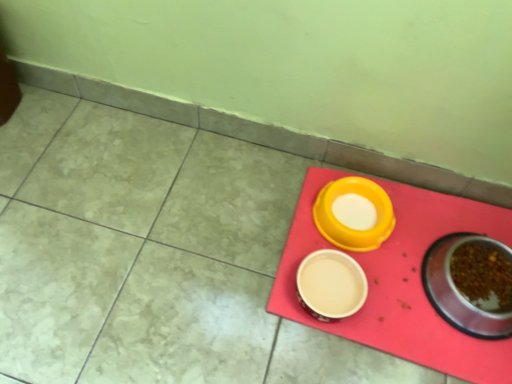
Question: Is beige ceramic bowl at center, placed as the 3th tableware when sorted from right to left, facing towards metallic stainless steel bowl at lower right, which is counted as the first tableware, starting from the right?

Choices:
 (A) no
 (B) yes

Answer: (A)

Question: Considering the relative sizes of beige ceramic bowl at center, the first tableware in the left-to-right sequence, and metallic stainless steel bowl at lower right, which is counted as the first tableware, starting from the right, in the image provided, is beige ceramic bowl at center, the first tableware in the left-to-right sequence, taller than metallic stainless steel bowl at lower right, which is counted as the first tableware, starting from the right,?

Choices:
 (A) yes
 (B) no

Answer: (B)

Question: Considering the relative sizes of beige ceramic bowl at center, the first tableware in the left-to-right sequence, and metallic stainless steel bowl at lower right, the third tableware positioned from the left, in the image provided, is beige ceramic bowl at center, the first tableware in the left-to-right sequence, shorter than metallic stainless steel bowl at lower right, the third tableware positioned from the left,?

Choices:
 (A) no
 (B) yes

Answer: (B)

Question: Considering the relative positions of beige ceramic bowl at center, placed as the 3th tableware when sorted from right to left, and metallic stainless steel bowl at lower right, which is counted as the first tableware, starting from the right, in the image provided, is beige ceramic bowl at center, placed as the 3th tableware when sorted from right to left, to the right of metallic stainless steel bowl at lower right, which is counted as the first tableware, starting from the right, from the viewer's perspective?

Choices:
 (A) no
 (B) yes

Answer: (A)

Question: Is beige ceramic bowl at center, the first tableware in the left-to-right sequence, facing away from metallic stainless steel bowl at lower right, the third tableware positioned from the left?

Choices:
 (A) no
 (B) yes

Answer: (A)

Question: In the image, is rubberized red tray at lower right positioned in front of or behind yellow plastic bowl at center, which ranks as the 2th tableware in right-to-left order?

Choices:
 (A) front
 (B) behind

Answer: (A)

Question: From a real-world perspective, is rubberized red tray at lower right physically located above or below yellow plastic bowl at center, which appears as the 2th tableware when viewed from the left?

Choices:
 (A) below
 (B) above

Answer: (A)

Question: Visually, is rubberized red tray at lower right positioned to the left or to the right of yellow plastic bowl at center, which ranks as the 2th tableware in right-to-left order?

Choices:
 (A) right
 (B) left

Answer: (A)

Question: Is rubberized red tray at lower right wider or thinner than yellow plastic bowl at center, which ranks as the 2th tableware in right-to-left order?

Choices:
 (A) thin
 (B) wide

Answer: (B)

Question: Is rubberized red tray at lower right inside the boundaries of beige ceramic bowl at center, the first tableware in the left-to-right sequence, or outside?

Choices:
 (A) outside
 (B) inside

Answer: (A)

Question: Is point (289, 286) closer or farther from the camera than point (339, 301)?

Choices:
 (A) closer
 (B) farther

Answer: (B)

Question: Is rubberized red tray at lower right wider or thinner than beige ceramic bowl at center, placed as the 3th tableware when sorted from right to left?

Choices:
 (A) thin
 (B) wide

Answer: (B)

Question: Is rubberized red tray at lower right in front of or behind beige ceramic bowl at center, placed as the 3th tableware when sorted from right to left, in the image?

Choices:
 (A) behind
 (B) front

Answer: (B)

Question: Is point (480, 268) positioned closer to the camera than point (411, 286)?

Choices:
 (A) closer
 (B) farther

Answer: (B)

Question: Considering their positions, is metallic stainless steel bowl at lower right, which is counted as the first tableware, starting from the right, located in front of or behind rubberized red tray at lower right?

Choices:
 (A) behind
 (B) front

Answer: (B)